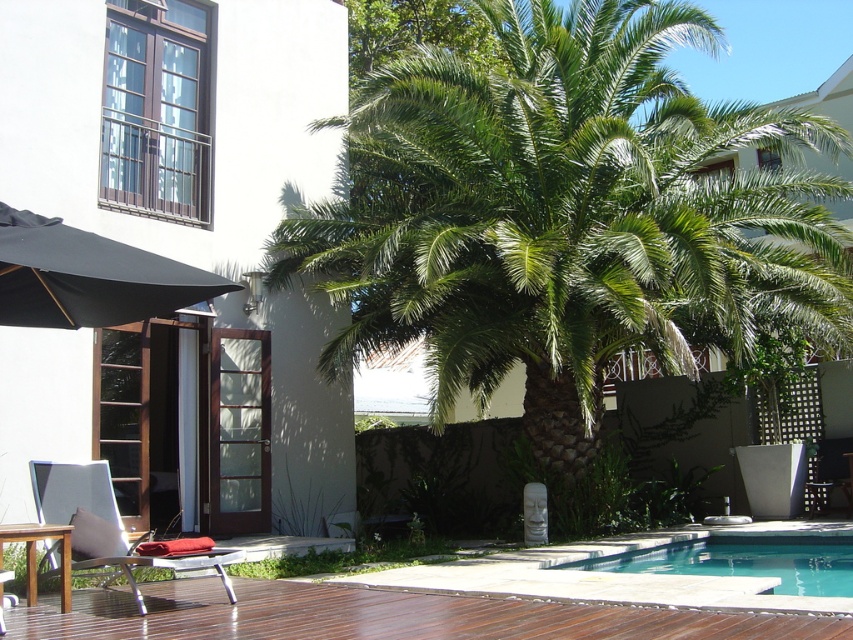
Question: Observing the image, what is the correct spatial positioning of dark brown wood deck at lower center in reference to clear glass pool at lower right?

Choices:
 (A) right
 (B) left

Answer: (B)

Question: Which point appears farthest from the camera in this image?

Choices:
 (A) (648, 548)
 (B) (209, 289)
 (C) (91, 493)
 (D) (682, 320)

Answer: (D)

Question: Which object is positioned closest to the green leafy palm tree at center?

Choices:
 (A) clear glass pool at lower right
 (B) metallic silver chair at lower left

Answer: (A)

Question: Which point appears closest to the camera in this image?

Choices:
 (A) (386, 636)
 (B) (86, 465)
 (C) (556, 272)

Answer: (A)

Question: Is clear glass pool at lower right in front of metallic silver chair at lower left?

Choices:
 (A) no
 (B) yes

Answer: (A)

Question: Does dark brown wood deck at lower center appear over black fabric umbrella at left?

Choices:
 (A) yes
 (B) no

Answer: (B)